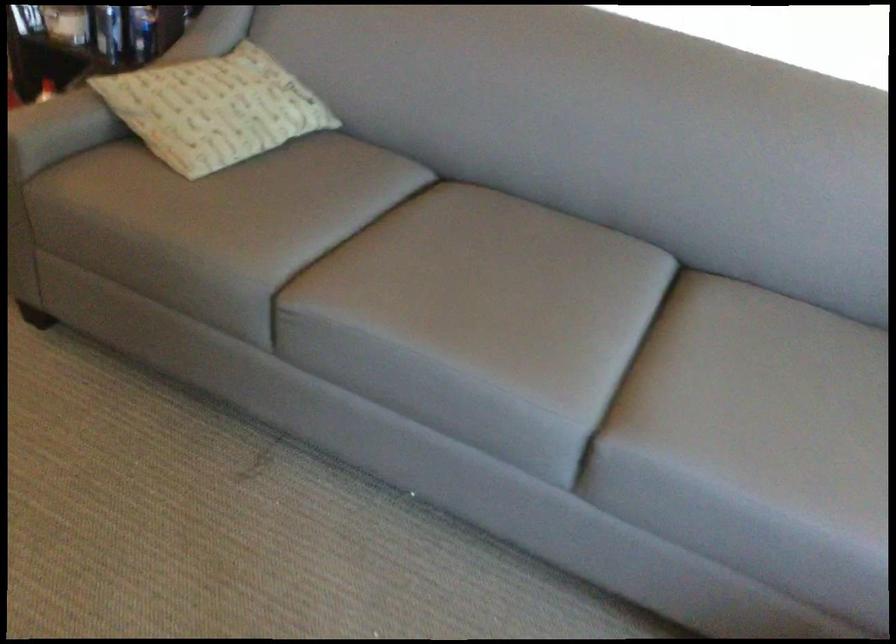
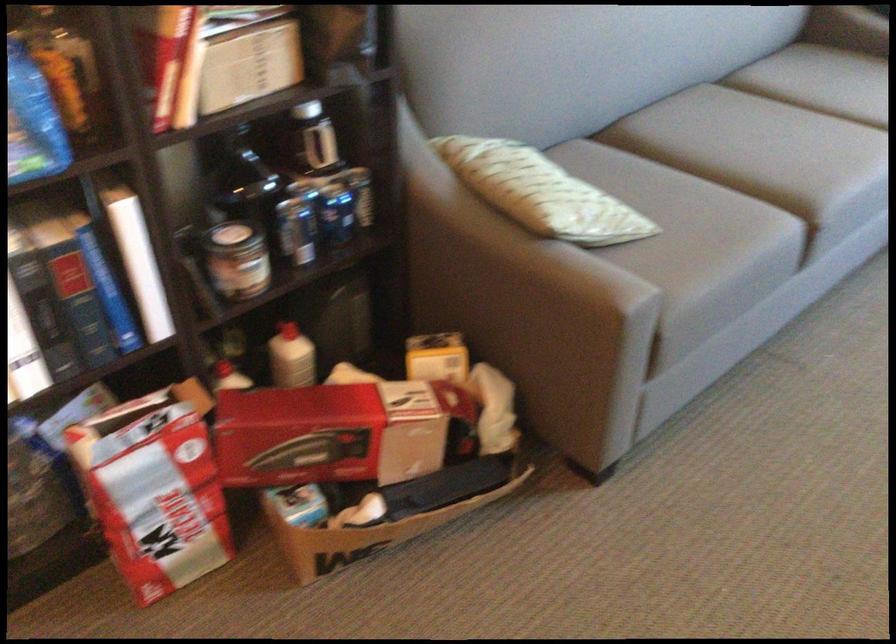
Find the pixel in the second image that matches the point at 457,278 in the first image.

(760, 147)